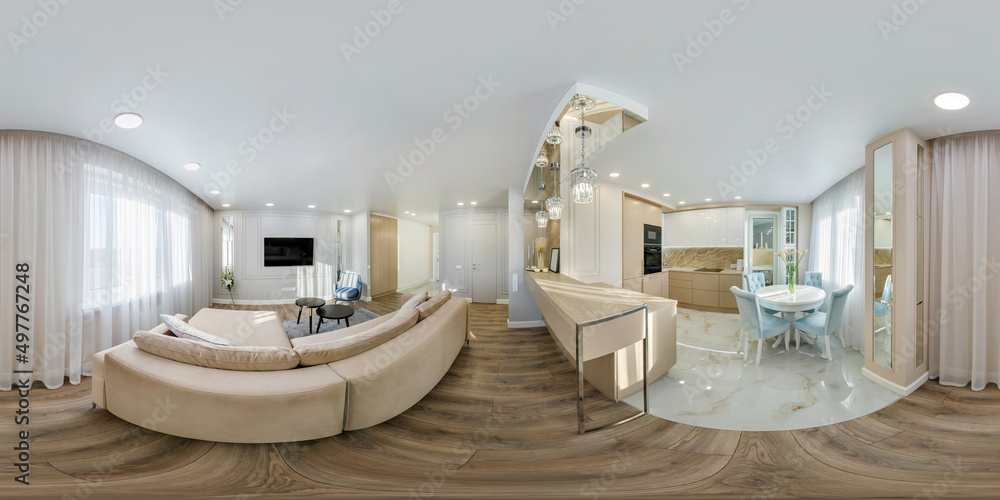
Image resolution: width=1000 pixels, height=500 pixels. Identify the location of oven. (649, 260).